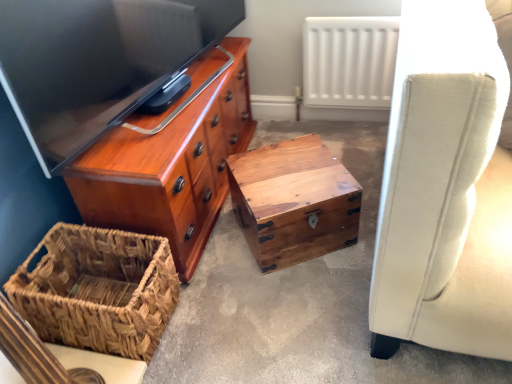
Where is `vacant space that's between woven brown picnic basket at lower left and natural wood trunk at center`? This screenshot has width=512, height=384. vacant space that's between woven brown picnic basket at lower left and natural wood trunk at center is located at coordinates (227, 275).